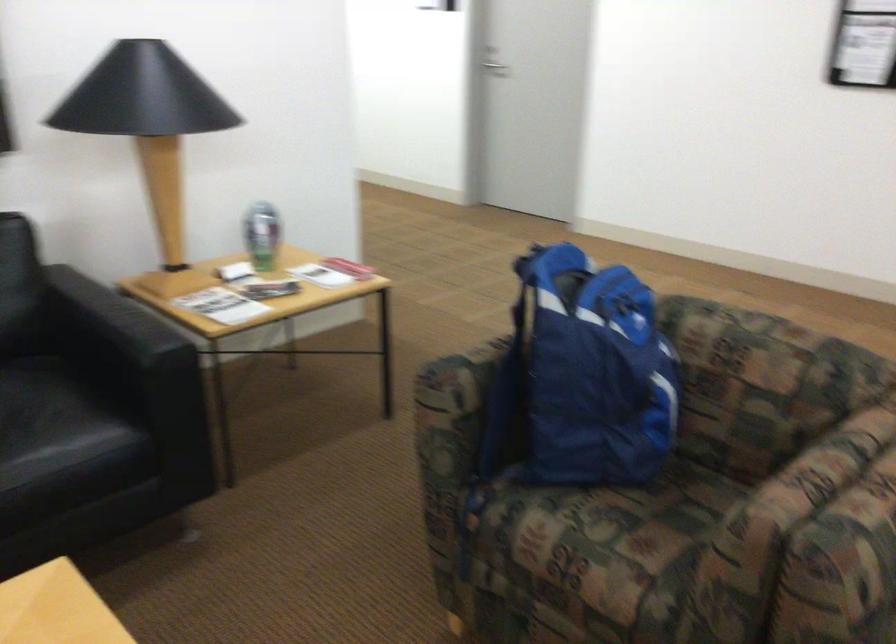
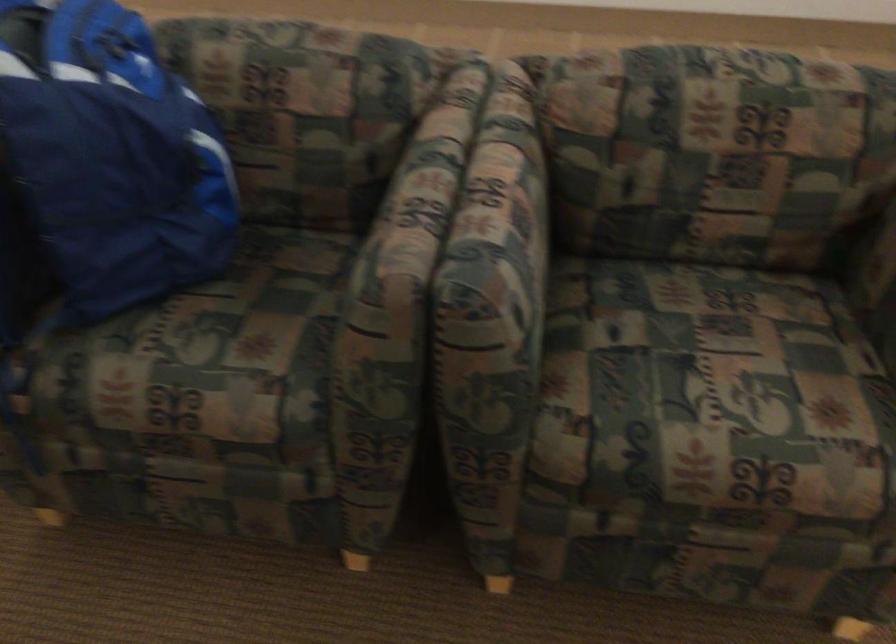
Where in the second image is the point corresponding to the point at 592,377 from the first image?

(112, 155)